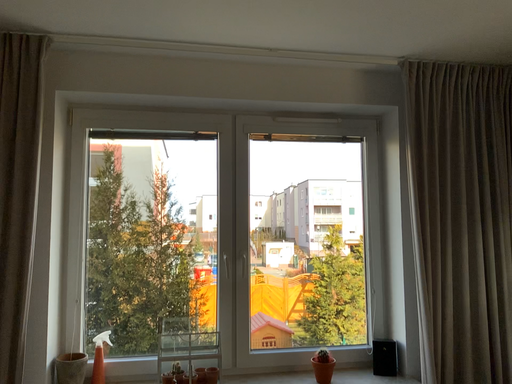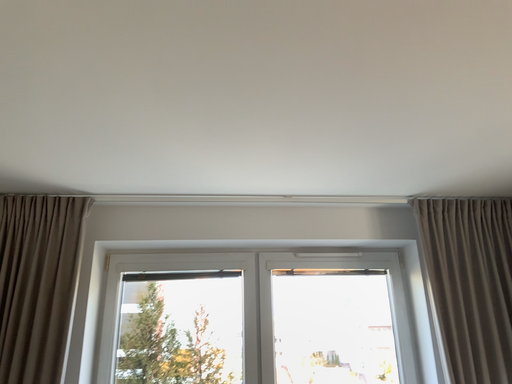
Question: How did the camera likely rotate when shooting the video?

Choices:
 (A) rotated downward
 (B) rotated upward

Answer: (B)